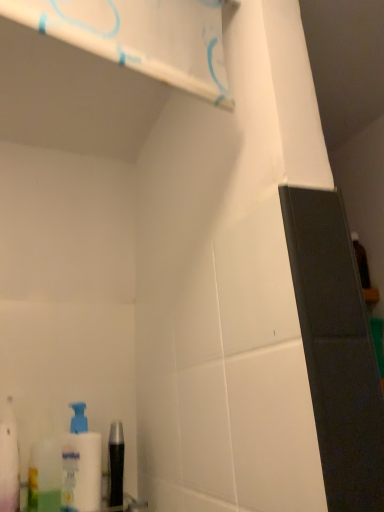
Question: Can you confirm if white glossy shelf at upper center is smaller than black glossy mouthwash at lower left, positioned as the first mouthwash in right-to-left order?

Choices:
 (A) yes
 (B) no

Answer: (B)

Question: From a real-world perspective, is white glossy shelf at upper center physically above black glossy mouthwash at lower left, the 2th mouthwash in the left-to-right sequence?

Choices:
 (A) no
 (B) yes

Answer: (B)

Question: Is white glossy shelf at upper center surrounding black glossy mouthwash at lower left, positioned as the first mouthwash in right-to-left order?

Choices:
 (A) no
 (B) yes

Answer: (A)

Question: From the image's perspective, is white glossy shelf at upper center on black glossy mouthwash at lower left, the 2th mouthwash in the left-to-right sequence?

Choices:
 (A) no
 (B) yes

Answer: (B)

Question: Is white glossy shelf at upper center behind black glossy mouthwash at lower left, positioned as the first mouthwash in right-to-left order?

Choices:
 (A) no
 (B) yes

Answer: (A)

Question: Are white glossy shelf at upper center and black glossy mouthwash at lower left, positioned as the first mouthwash in right-to-left order, located far from each other?

Choices:
 (A) yes
 (B) no

Answer: (B)

Question: From a real-world perspective, is black glossy mouthwash at lower left, the 2th mouthwash in the left-to-right sequence, physically above translucent plastic mouthwash at lower left, acting as the 1th mouthwash starting from the left?

Choices:
 (A) no
 (B) yes

Answer: (A)

Question: Can you confirm if black glossy mouthwash at lower left, positioned as the first mouthwash in right-to-left order, is wider than translucent plastic mouthwash at lower left, the 2th mouthwash viewed from the right?

Choices:
 (A) yes
 (B) no

Answer: (B)

Question: Can you confirm if black glossy mouthwash at lower left, the 2th mouthwash in the left-to-right sequence, is shorter than translucent plastic mouthwash at lower left, the 2th mouthwash viewed from the right?

Choices:
 (A) yes
 (B) no

Answer: (A)

Question: From a real-world perspective, is black glossy mouthwash at lower left, positioned as the first mouthwash in right-to-left order, located beneath translucent plastic mouthwash at lower left, acting as the 1th mouthwash starting from the left?

Choices:
 (A) yes
 (B) no

Answer: (A)

Question: Is black glossy mouthwash at lower left, positioned as the first mouthwash in right-to-left order, bigger than translucent plastic mouthwash at lower left, the 2th mouthwash viewed from the right?

Choices:
 (A) no
 (B) yes

Answer: (A)

Question: Is translucent plastic mouthwash at lower left, acting as the 1th mouthwash starting from the left, located within black glossy mouthwash at lower left, the 2th mouthwash in the left-to-right sequence?

Choices:
 (A) no
 (B) yes

Answer: (A)

Question: From a real-world perspective, is white plastic pump bottle at lower left physically below white plastic bottle at lower left?

Choices:
 (A) no
 (B) yes

Answer: (B)